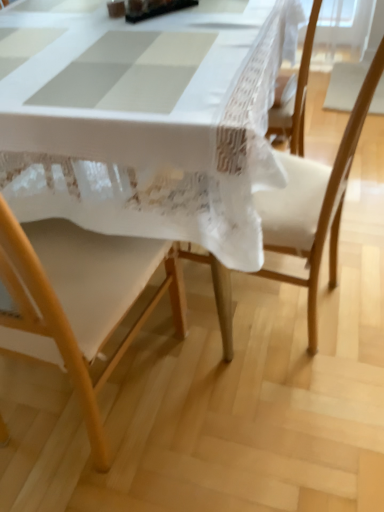
You are a GUI agent. You are given a task and a screenshot of the screen. Output one action in this format:
    pyautogui.click(x=<x>, y=<y>)
    Task: Click on the free space in front of wooden chair at center, arranged as the first chair when viewed from the right
    The image size is (384, 512).
    Given the screenshot: What is the action you would take?
    pyautogui.click(x=269, y=412)